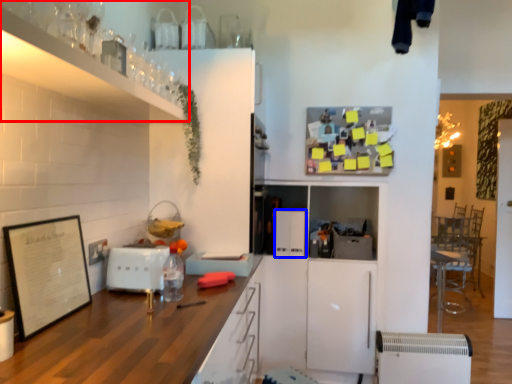
Question: Among these objects, which one is farthest to the camera, cabinetry (highlighted by a red box) or appliance (highlighted by a blue box)?

Choices:
 (A) cabinetry
 (B) appliance

Answer: (B)